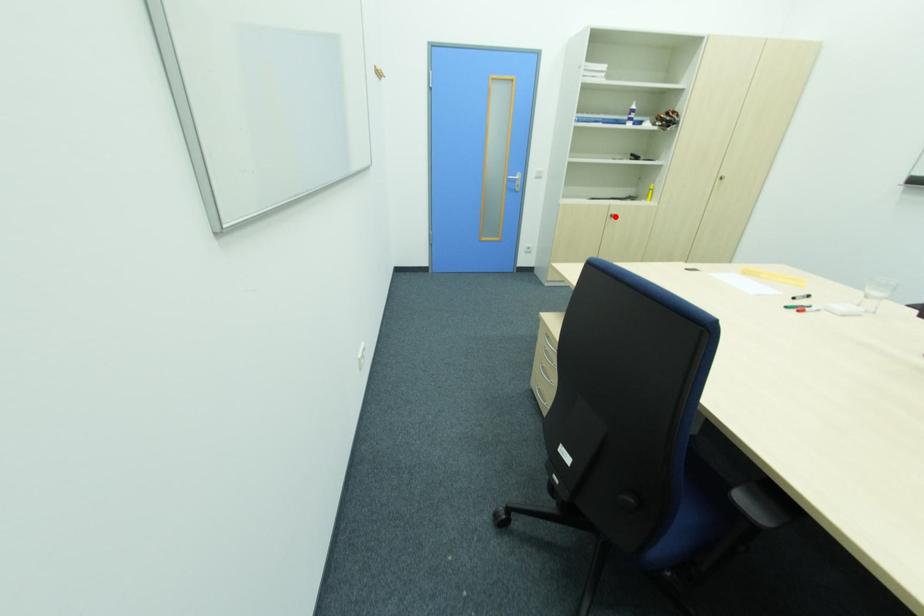
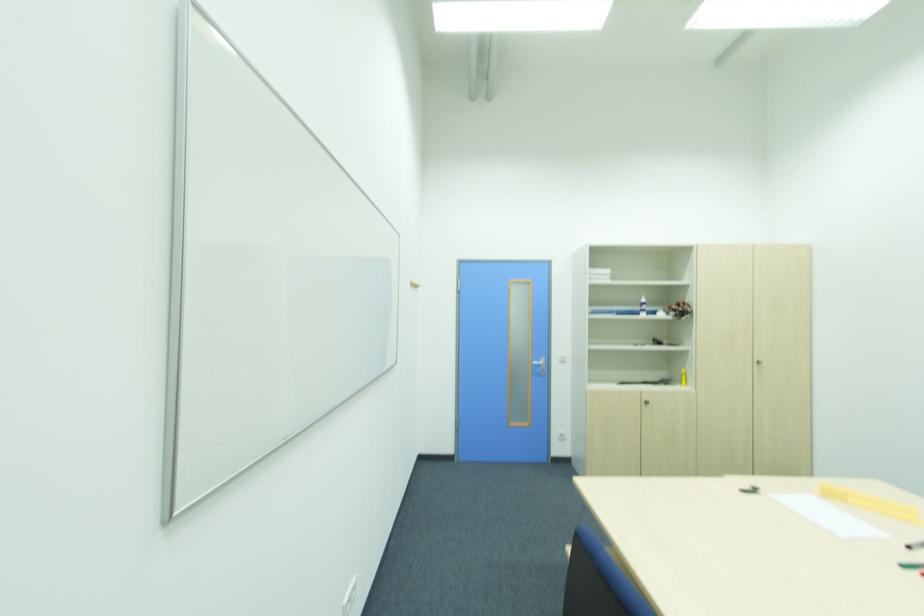
Locate, in the second image, the point that corresponds to the highlighted location in the first image.

(650, 402)